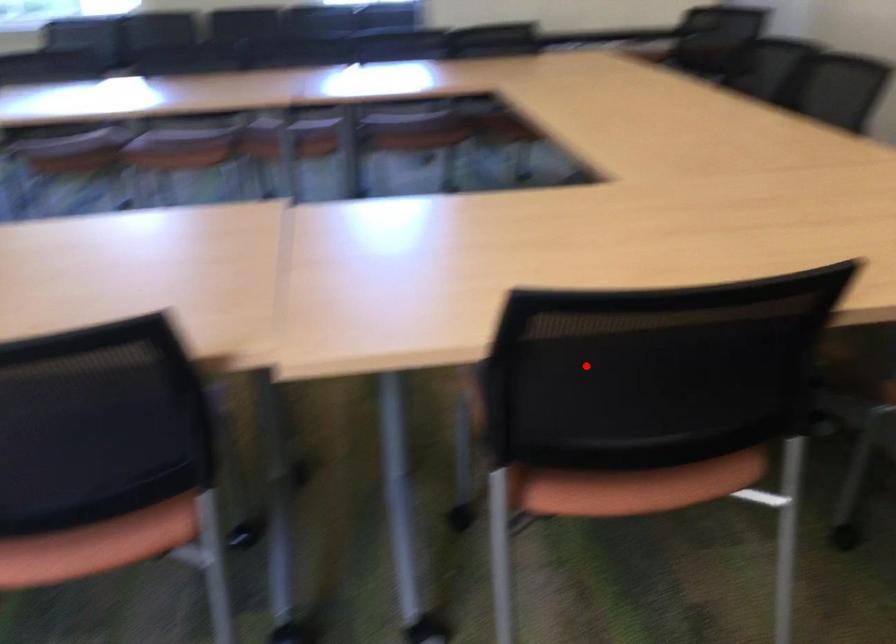
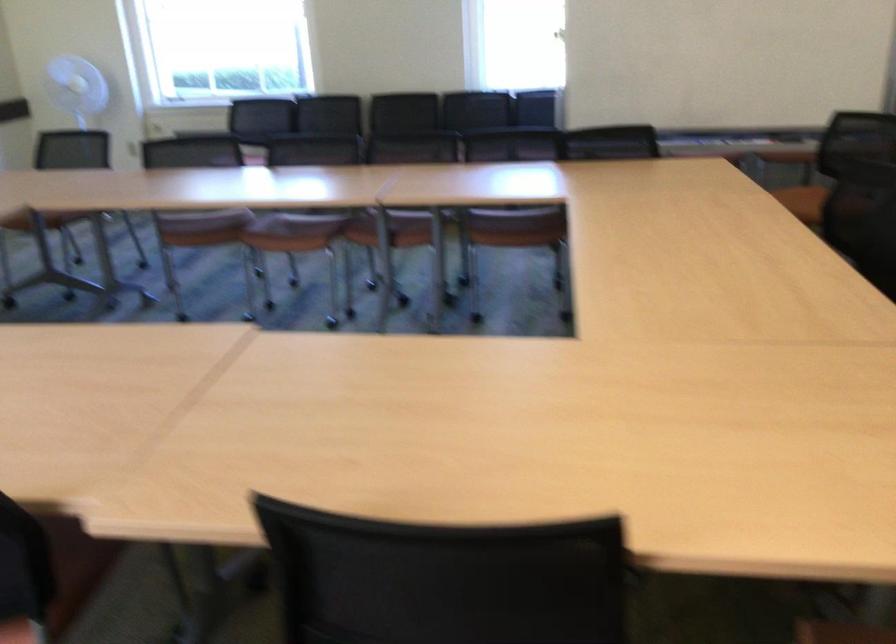
Locate, in the second image, the point that corresponds to the highlighted location in the first image.

(444, 579)